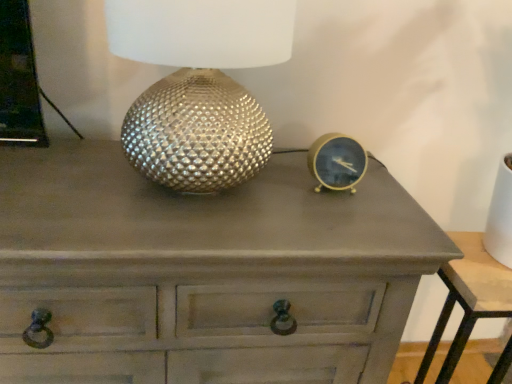
Locate an element on the screen. The width and height of the screenshot is (512, 384). free spot to the right of metallic textured lamp at center is located at coordinates (331, 210).